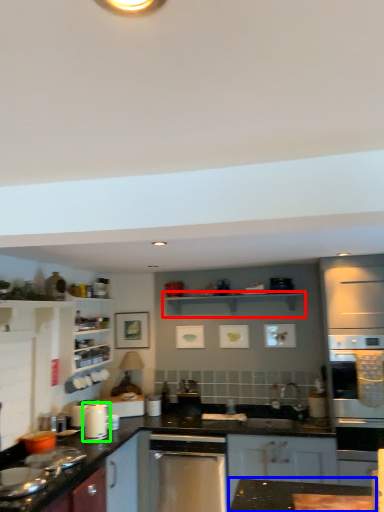
Question: Based on their relative distances, which object is nearer to shelf (highlighted by a red box)? Choose from countertop (highlighted by a blue box) and kitchen appliance (highlighted by a green box).

Choices:
 (A) countertop
 (B) kitchen appliance

Answer: (B)